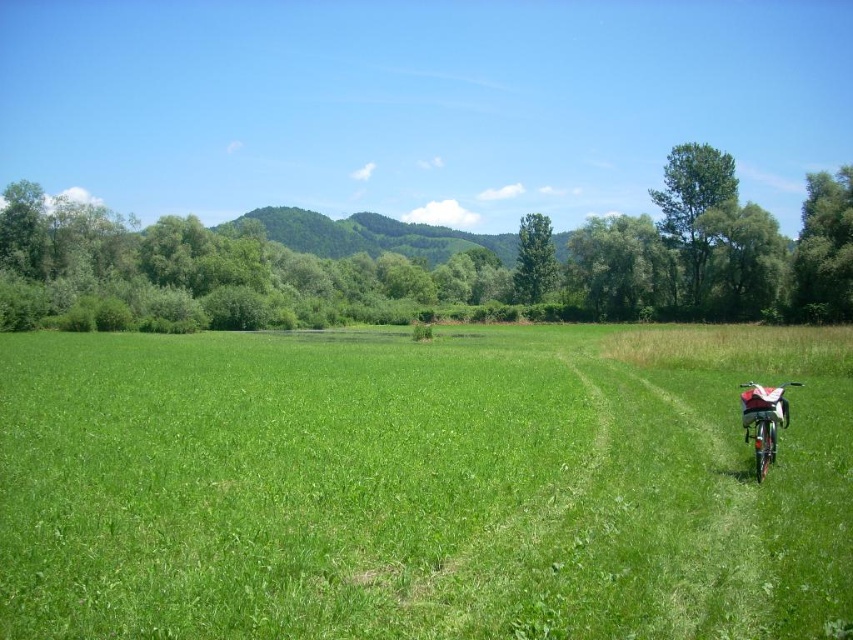
Who is higher up, green grassy field at center or metallic silver bicycle at lower right?

Positioned higher is green grassy field at center.

Is point (206, 616) positioned before point (764, 403)?

Yes.

Between point (286, 442) and point (767, 428), which one is positioned in front?

Positioned in front is point (767, 428).

Where is `green grassy field at center`? Image resolution: width=853 pixels, height=640 pixels. green grassy field at center is located at coordinates (422, 484).